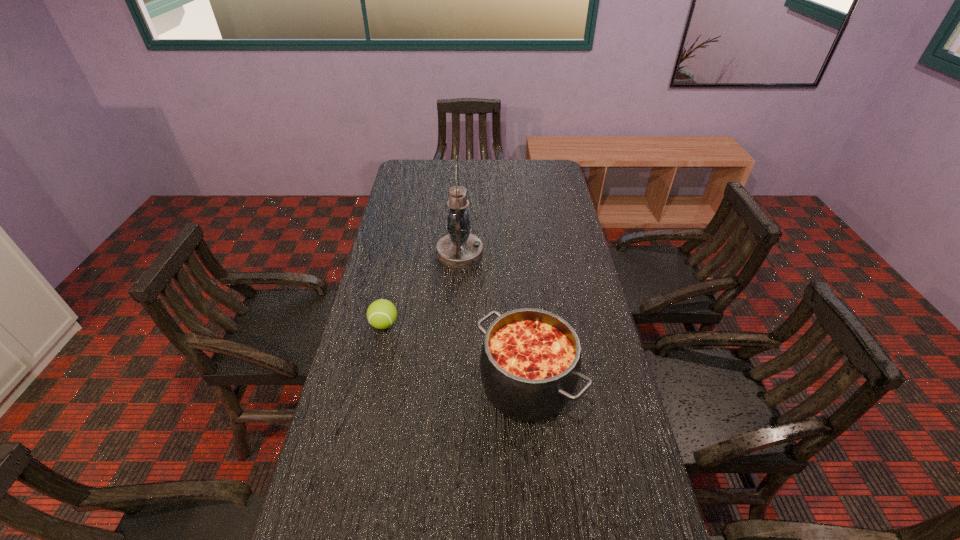
The height and width of the screenshot is (540, 960). In order to click on free space that is in between the second tallest object and the shortest object in this screenshot , I will do `click(456, 354)`.

Find the location of a particular element. The height and width of the screenshot is (540, 960). free spot between the second nearest object and the farthest object is located at coordinates coord(422,288).

This screenshot has width=960, height=540. I want to click on free spot between the farthest object and the casserole, so click(x=493, y=319).

Identify the location of free space between the second shortest object and the tennis ball. (456, 354).

The image size is (960, 540). I want to click on vacant area that lies between the tennis ball and the oil lamp, so click(422, 288).

The height and width of the screenshot is (540, 960). Identify the location of object that can be found as the closest to the shortest object. pyautogui.click(x=459, y=248).

This screenshot has height=540, width=960. Find the location of `object that stands as the second closest to the leftmost object`. object that stands as the second closest to the leftmost object is located at coordinates (530, 361).

I want to click on free location that satisfies the following two spatial constraints: 1. on the back side of the tallest object; 2. on the right side of the tennis ball, so click(399, 253).

The width and height of the screenshot is (960, 540). In order to click on free spot that satisfies the following two spatial constraints: 1. on the front side of the leftmost object; 2. on the right side of the second tallest object in this screenshot , I will do `click(372, 384)`.

The image size is (960, 540). Identify the location of vacant space that satisfies the following two spatial constraints: 1. on the front side of the casserole; 2. on the right side of the oil lamp. (453, 384).